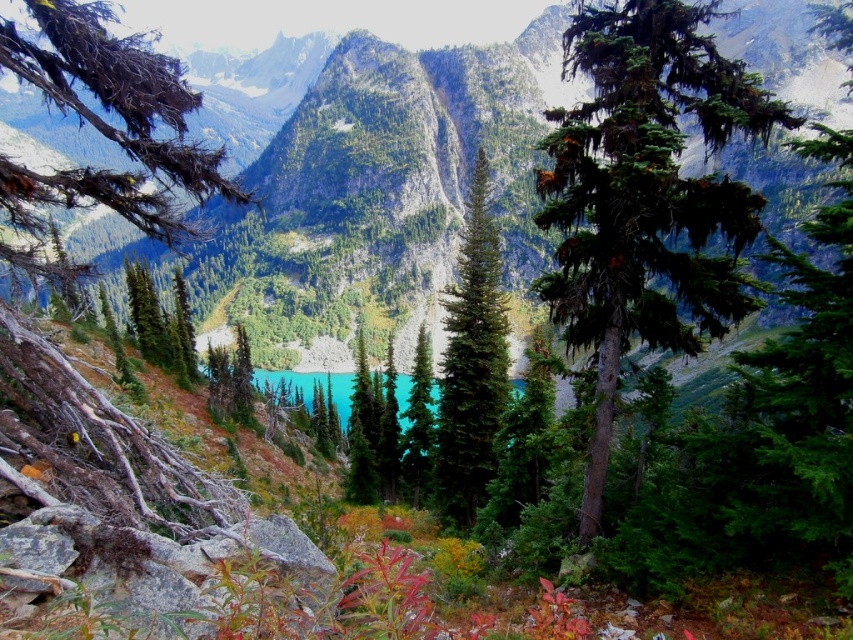
You are a hiker trying to determine which tree is better suited for shade. The scene has a green matte tree at center and a green matte evergreen tree at center. Which one provides more shade due to its size?

The green matte tree at center is larger in size than the green matte evergreen tree at center, so it provides more shade.

You are a hiker who wants to take a photo of both the green matte tree at center and the green matte evergreen tree at center in the same frame. Which tree should you move closer to in order to include both trees fully in your camera view?

You should move closer to the green matte evergreen tree at center because it is shorter than the green matte tree at center, allowing you to frame both within the camera view more easily.

From the picture: You are a hiker planning to set up a tent between the green matte tree at center and the green glossy tree at center. Which tree should you place your tent closer to if you want to maximize space between the two trees?

The green matte tree at center might be wider than green glossy tree at center, so placing the tent closer to the green glossy tree at center would allow more space between the two trees.